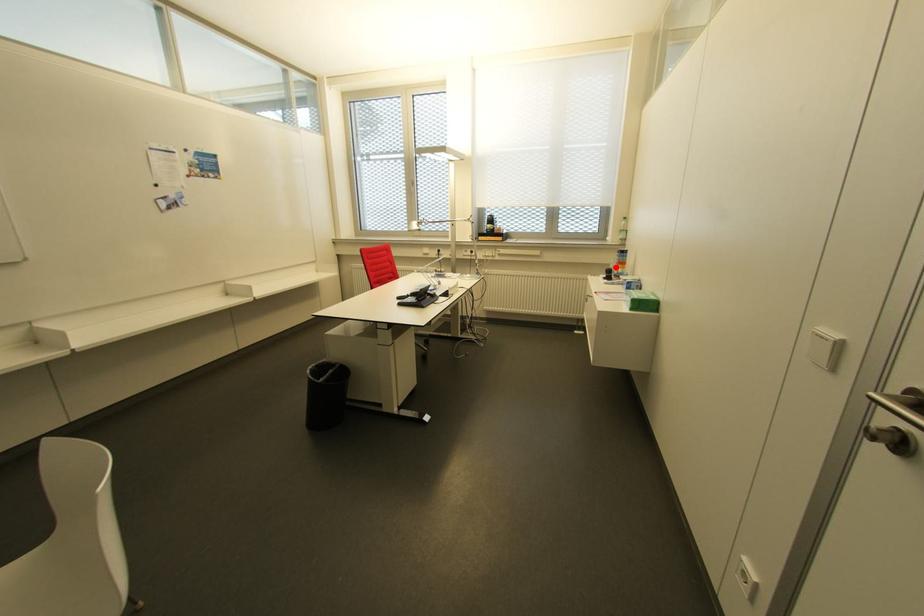
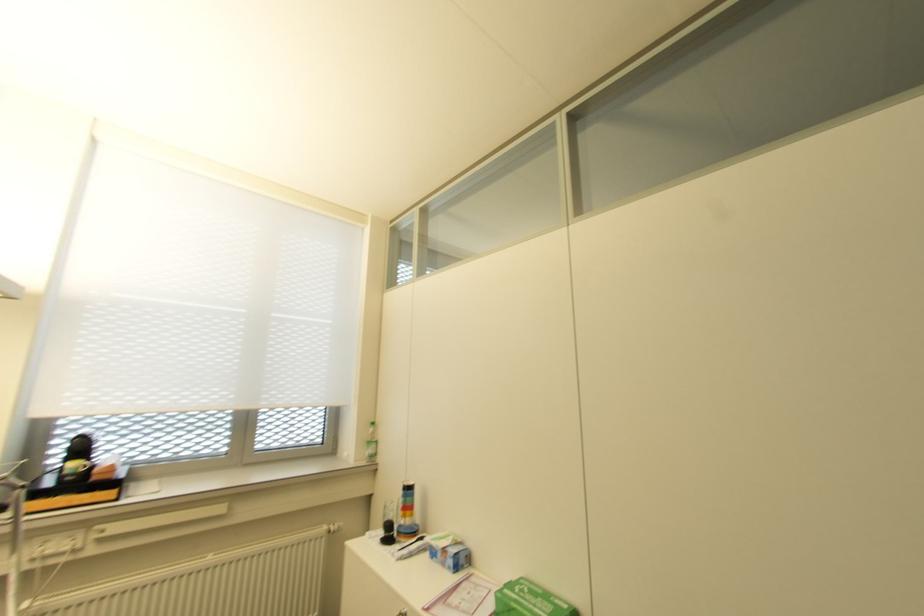
Question: I am providing you with two images of the same scene from different viewpoints. Image1 has a red point marked. In image2, the corresponding 3D location appears at what relative position? Reply with the corresponding letter.

Choices:
 (A) Closer
 (B) Farther

Answer: (B)